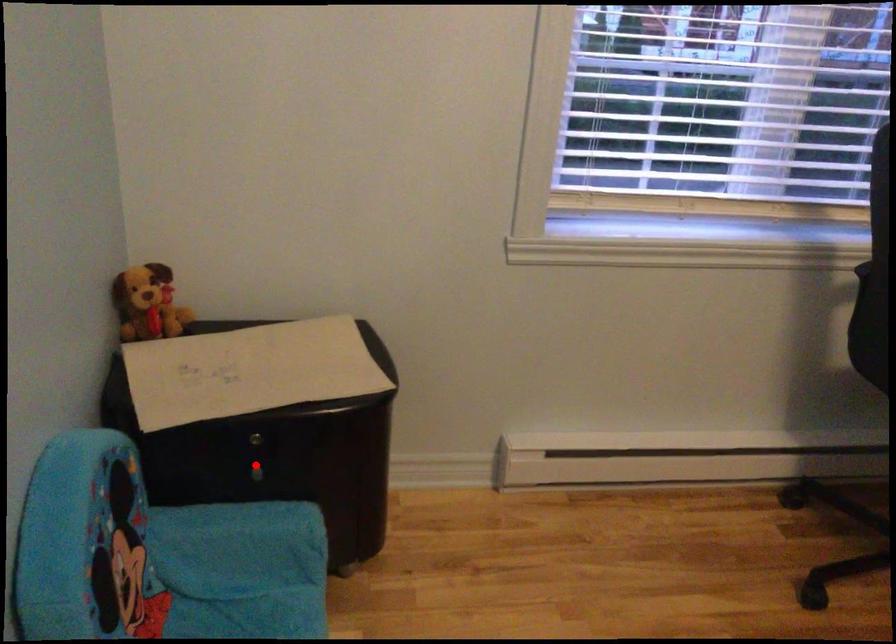
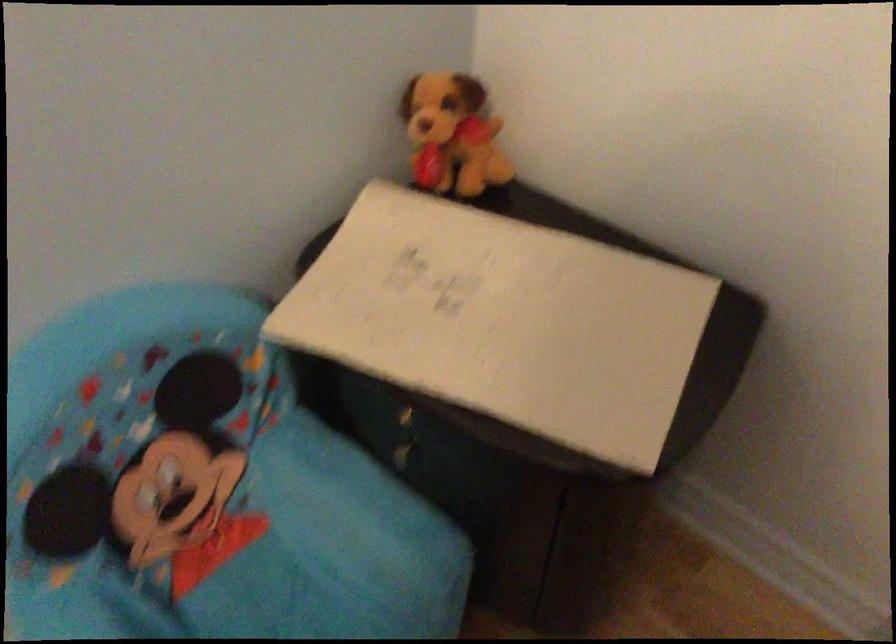
Question: I am providing you with two images of the same scene from different viewpoints. Given a red point in image1, look at the same physical point in image2. Is it:

Choices:
 (A) Closer to the viewpoint
 (B) Farther from the viewpoint

Answer: (A)